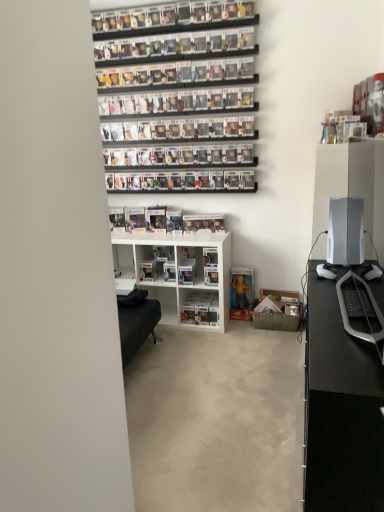
Question: Visually, is black glossy desk at right positioned to the left or to the right of white glossy desktop at right?

Choices:
 (A) left
 (B) right

Answer: (A)

Question: Is black glossy desk at right in front of or behind white glossy desktop at right in the image?

Choices:
 (A) front
 (B) behind

Answer: (A)

Question: Which object is positioned closest to the black glossy desk at right?

Choices:
 (A) clear plastic figure at center
 (B) yellow matte action figure at lower center
 (C) white glossy desktop at right
 (D) white plastic shelf at center, the first shelf when ordered from right to left
 (E) beige carpet at center

Answer: (C)

Question: Estimate the real-world distances between objects in this image. Which object is closer to the yellow matte action figure at lower center?

Choices:
 (A) black glossy desk at right
 (B) white matte shelf at center, placed as the 1th shelf when sorted from left to right
 (C) beige carpet at center
 (D) clear plastic figure at center
 (E) white glossy desktop at right

Answer: (B)